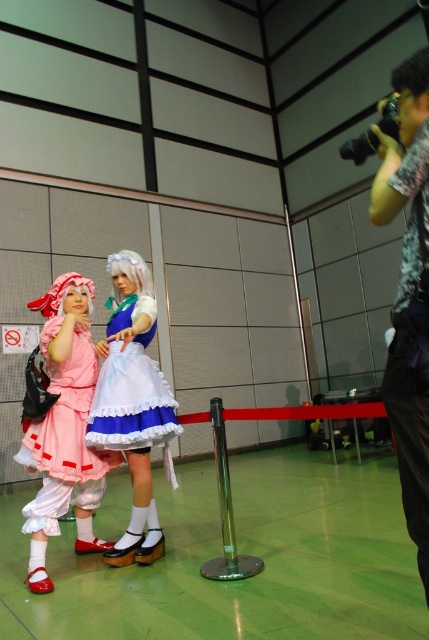
Question: Is dark floral shirt at right below matte blue dress at center?

Choices:
 (A) no
 (B) yes

Answer: (A)

Question: Estimate the real-world distances between objects in this image. Which object is farther from the white silky wig at center?

Choices:
 (A) dark floral shirt at right
 (B) matte blue dress at center
 (C) white silky wig at upper right
 (D) matte pink dress at left

Answer: (A)

Question: Can you confirm if matte pink dress at left is positioned to the right of matte blue dress at center?

Choices:
 (A) yes
 (B) no

Answer: (B)

Question: Is dark floral shirt at right above matte pink dress at left?

Choices:
 (A) no
 (B) yes

Answer: (B)

Question: Which point is closer to the camera taking this photo?

Choices:
 (A) (87, 291)
 (B) (135, 259)

Answer: (A)

Question: Which object is closer to the camera taking this photo?

Choices:
 (A) white silky wig at center
 (B) matte pink dress at left
 (C) white silky wig at upper right
 (D) matte blue dress at center

Answer: (C)